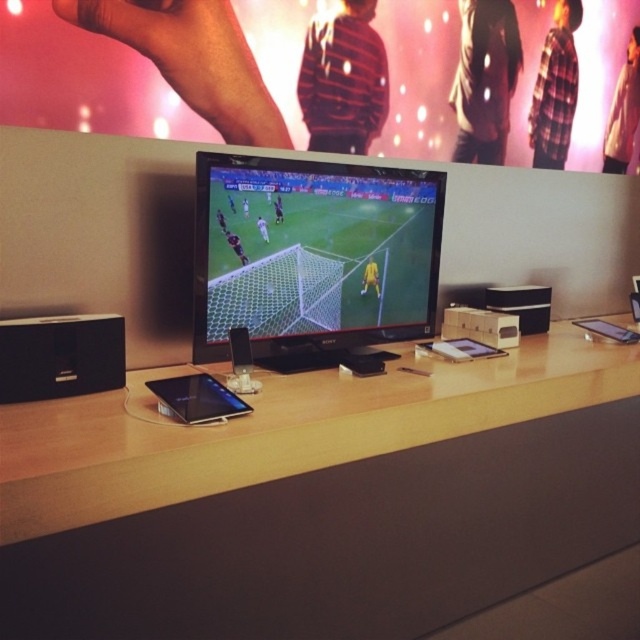
Question: Which point is farther from the camera taking this photo?

Choices:
 (A) (400, 243)
 (B) (12, 371)
 (C) (243, 518)

Answer: (A)

Question: Which of the following is the farthest from the observer?

Choices:
 (A) wooden table at center
 (B) black plastic speaker at lower left
 (C) satin black monitor at center

Answer: (C)

Question: Can you confirm if satin black monitor at center is wider than black plastic speaker at lower left?

Choices:
 (A) no
 (B) yes

Answer: (B)

Question: Does satin black monitor at center have a larger size compared to black plastic speaker at lower left?

Choices:
 (A) no
 (B) yes

Answer: (B)

Question: Is wooden table at center positioned at the back of satin black monitor at center?

Choices:
 (A) no
 (B) yes

Answer: (A)

Question: Among these objects, which one is farthest from the camera?

Choices:
 (A) satin black monitor at center
 (B) black plastic speaker at lower left
 (C) wooden table at center

Answer: (A)